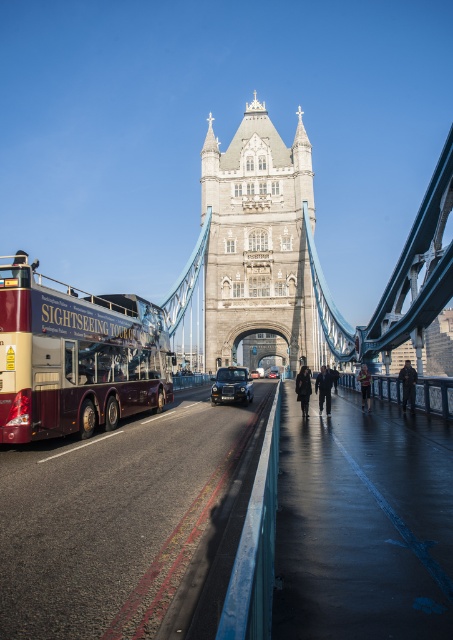
Between stone gothic tower at center and shiny black car at center, which one appears on the left side from the viewer's perspective?

From the viewer's perspective, shiny black car at center appears more on the left side.

Is point (226, 253) more distant than point (255, 369)?

No, (226, 253) is in front of (255, 369).

What do you see at coordinates (258, 243) in the screenshot? The height and width of the screenshot is (640, 453). I see `stone gothic tower at center` at bounding box center [258, 243].

The width and height of the screenshot is (453, 640). I want to click on stone gothic tower at center, so click(x=258, y=243).

Between dark suit at center and shiny black car at center, which one is positioned lower?

dark suit at center is lower down.

Does dark suit at center have a smaller size compared to shiny black car at center?

No.

Between point (322, 365) and point (259, 376), which one is positioned in front?

Point (322, 365) is more forward.

This screenshot has width=453, height=640. In order to click on dark suit at center in this screenshot , I will do `click(323, 388)`.

How distant is stone gothic tower at center from dark blue jacket at right?

The distance of stone gothic tower at center from dark blue jacket at right is 166.32 feet.

Who is more distant from viewer, (261, 144) or (414, 381)?

The point (261, 144) is more distant.

Is point (244, 298) positioned in front of point (411, 378)?

No.

This screenshot has width=453, height=640. In order to click on stone gothic tower at center in this screenshot , I will do `click(258, 243)`.